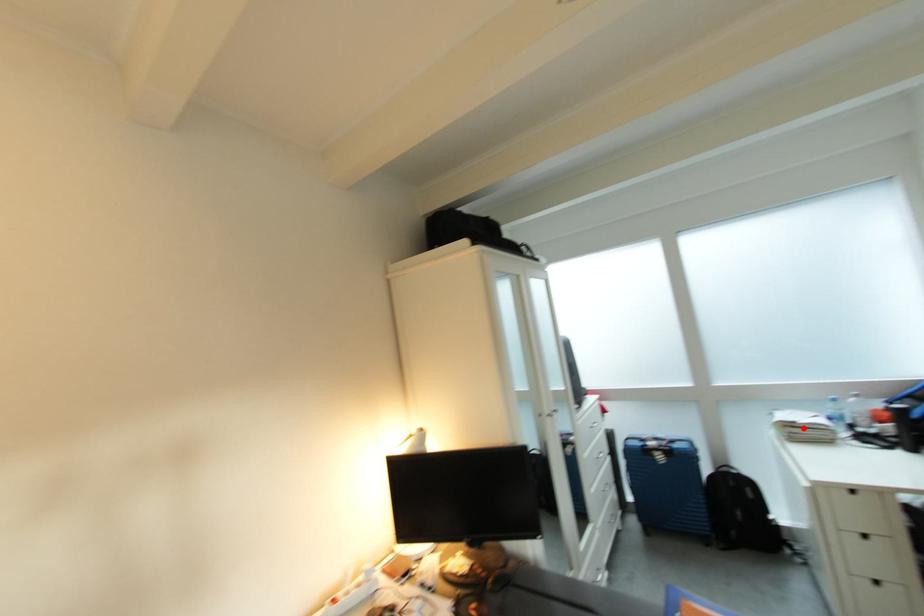
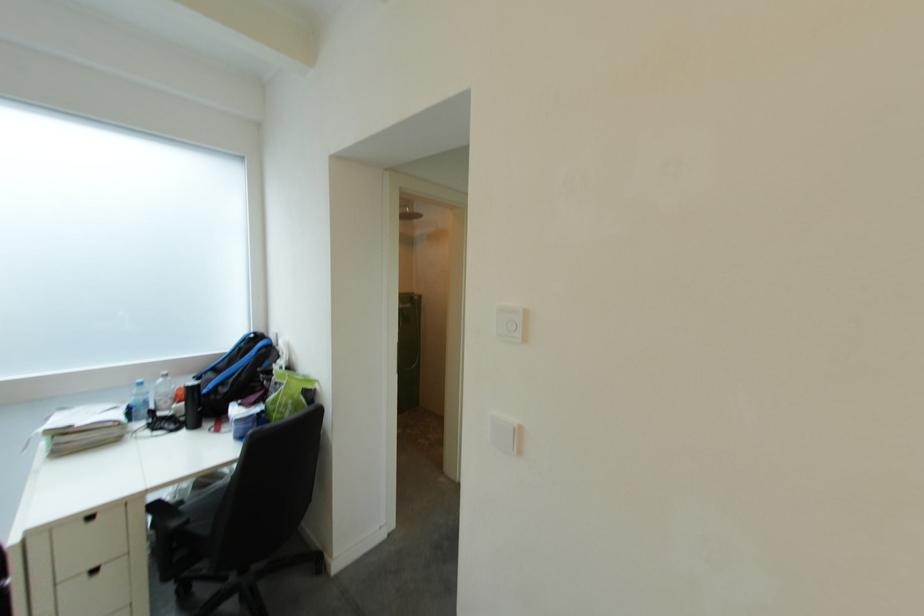
Question: I am providing you with two images of the same scene from different viewpoints. Image1 has a red point marked. In image2, the corresponding 3D location appears at what relative position? Reply with the corresponding letter.

Choices:
 (A) Closer
 (B) Farther

Answer: (A)